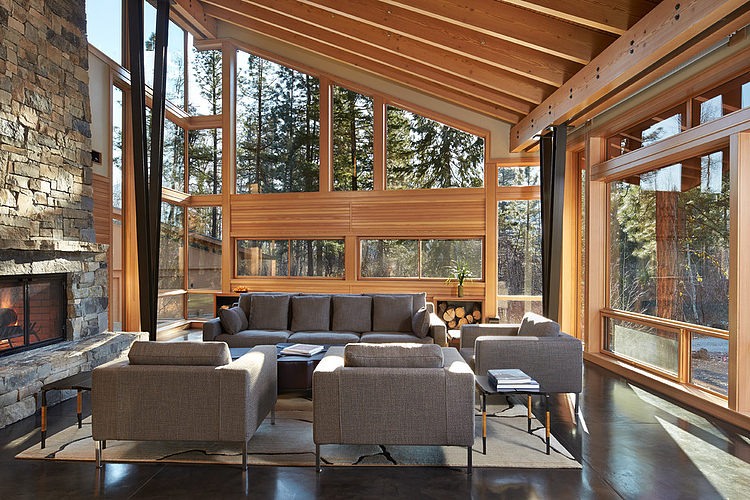
Find the location of `chair`. chair is located at coordinates 428,406.